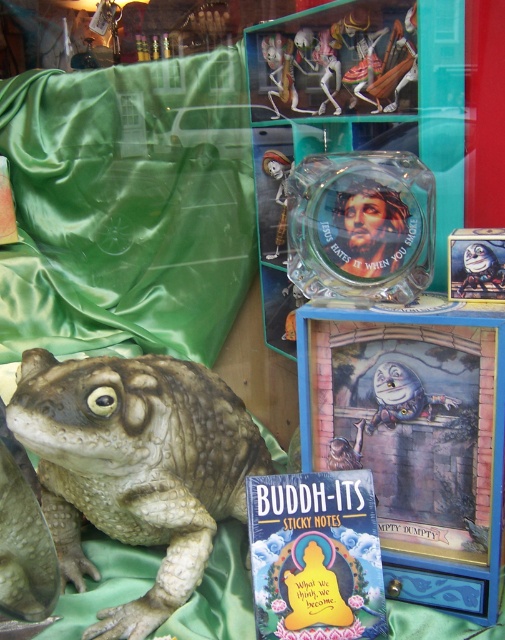
Based on the photo, does leather-like brown frog at lower left appear on the right side of green rubber frog at lower left?

Incorrect, leather-like brown frog at lower left is not on the right side of green rubber frog at lower left.

Is leather-like brown frog at lower left wider than green rubber frog at lower left?

Yes.

This screenshot has width=505, height=640. I want to click on leather-like brown frog at lower left, so click(135, 467).